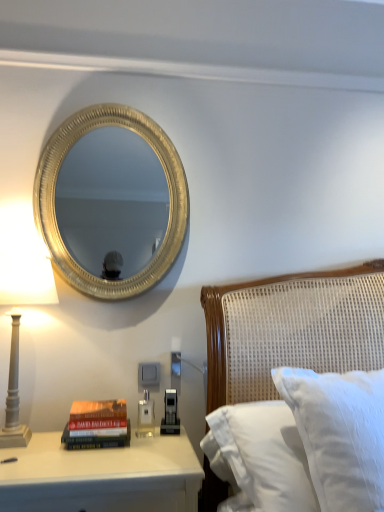
You are a GUI agent. You are given a task and a screenshot of the screen. Output one action in this format:
    pyautogui.click(x=<x>, y=<y>)
    Task: Click on the free space above white glossy nightstand at lower left (from a real-world perspective)
    The width and height of the screenshot is (384, 512).
    Given the screenshot: What is the action you would take?
    pyautogui.click(x=97, y=452)